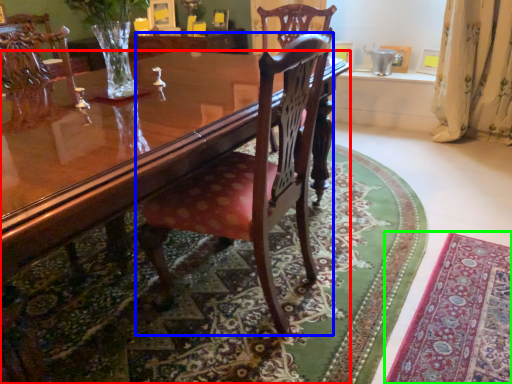
Question: Which is nearer to the coffee table (highlighted by a red box)? chair (highlighted by a blue box) or mat (highlighted by a green box).

Choices:
 (A) chair
 (B) mat

Answer: (A)